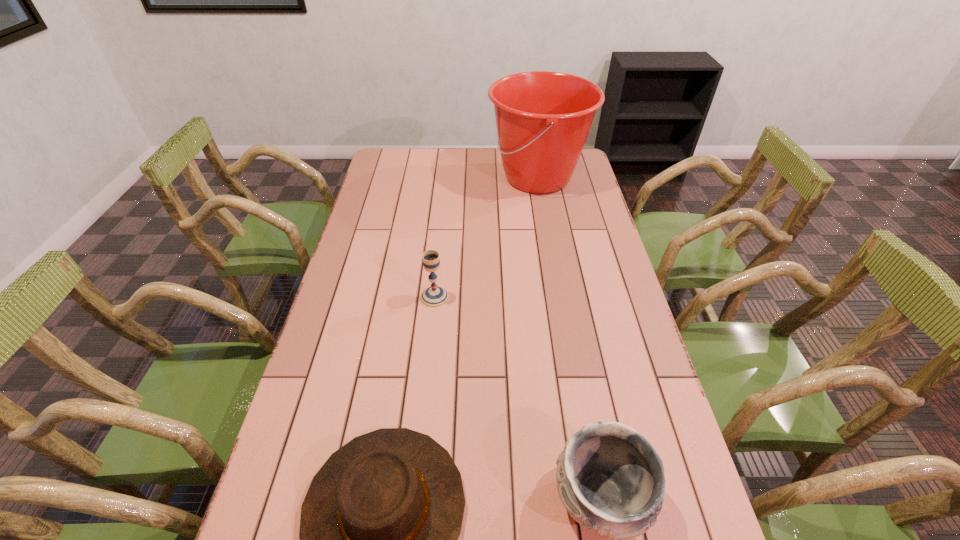
In the image, there is a desktop. Where is `vacant space at the far edge`? The height and width of the screenshot is (540, 960). vacant space at the far edge is located at coordinates (467, 151).

Locate an element on the screen. This screenshot has width=960, height=540. free space at the left edge of the desktop is located at coordinates (328, 312).

Where is `free region at the right edge`? The image size is (960, 540). free region at the right edge is located at coordinates (592, 230).

Choose which object is the nearest neighbor to the pottery. Please provide its 2D coordinates. Your answer should be formatted as a tuple, i.e. [(x, y)], where the tuple contains the x and y coordinates of a point satisfying the conditions above.

[(379, 524)]

Locate an element on the screen. object that is the second closest to the cowboy hat is located at coordinates (434, 296).